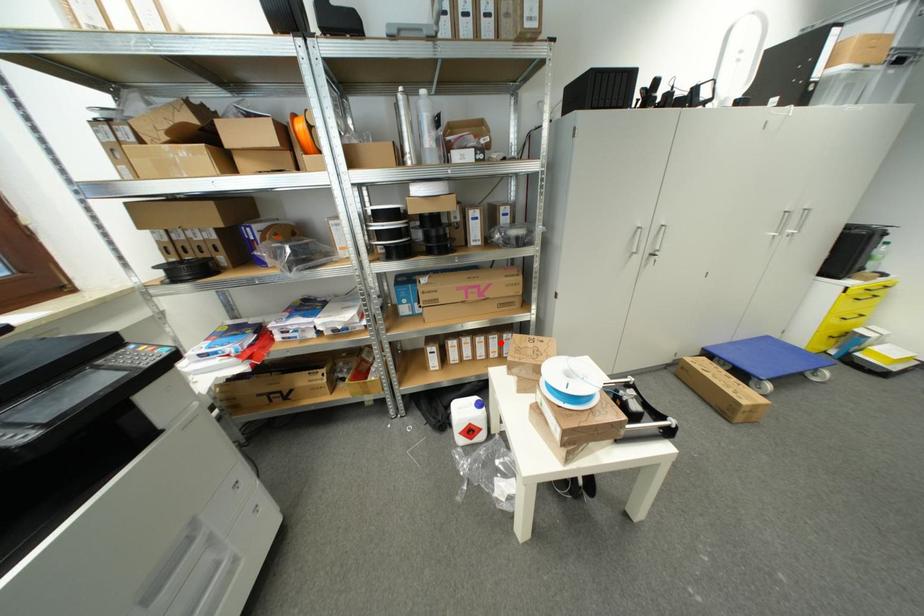
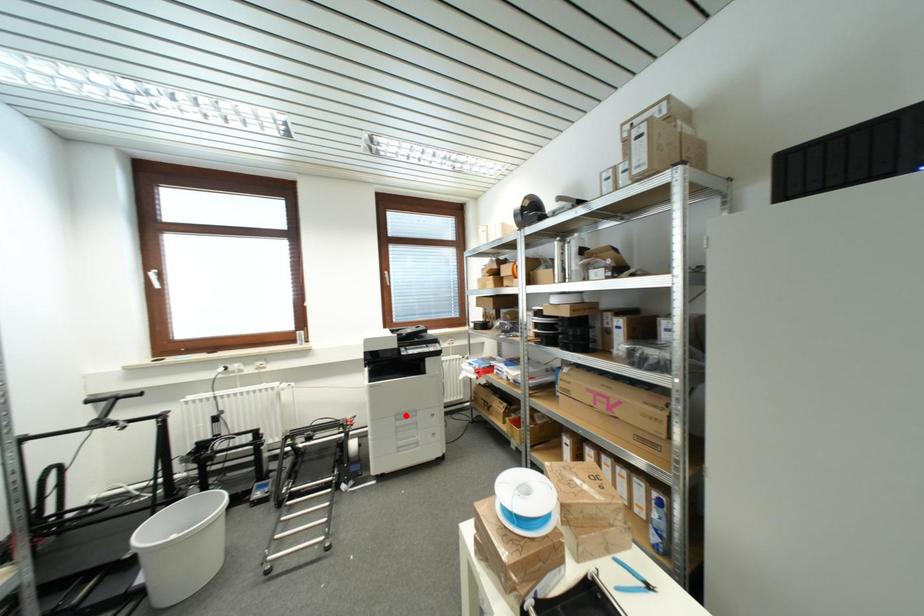
I am providing you with two images of the same scene from different viewpoints. A red point is marked on the first image and another point is marked on the second image. Are the points marked in image1 and image2 representing the same 3D position?

No